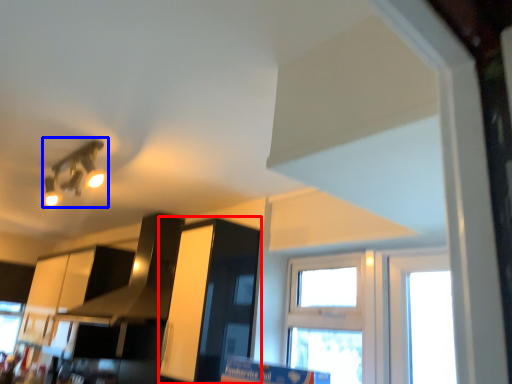
Question: Which object appears closest to the camera in this image, cabinetry (highlighted by a red box) or light fixture (highlighted by a blue box)?

Choices:
 (A) cabinetry
 (B) light fixture

Answer: (B)